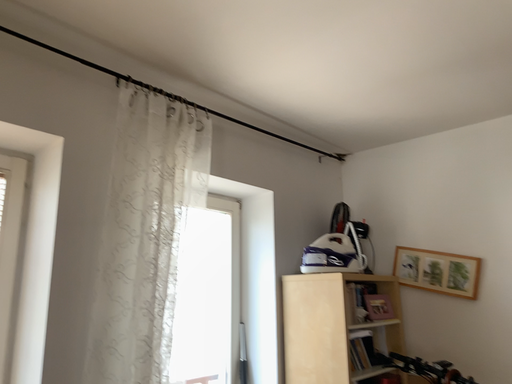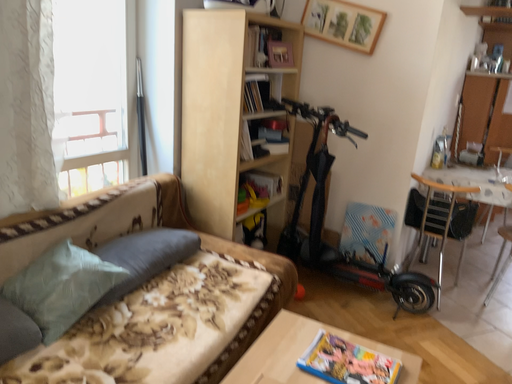
Question: Which way did the camera rotate in the video?

Choices:
 (A) rotated downward
 (B) rotated upward

Answer: (A)